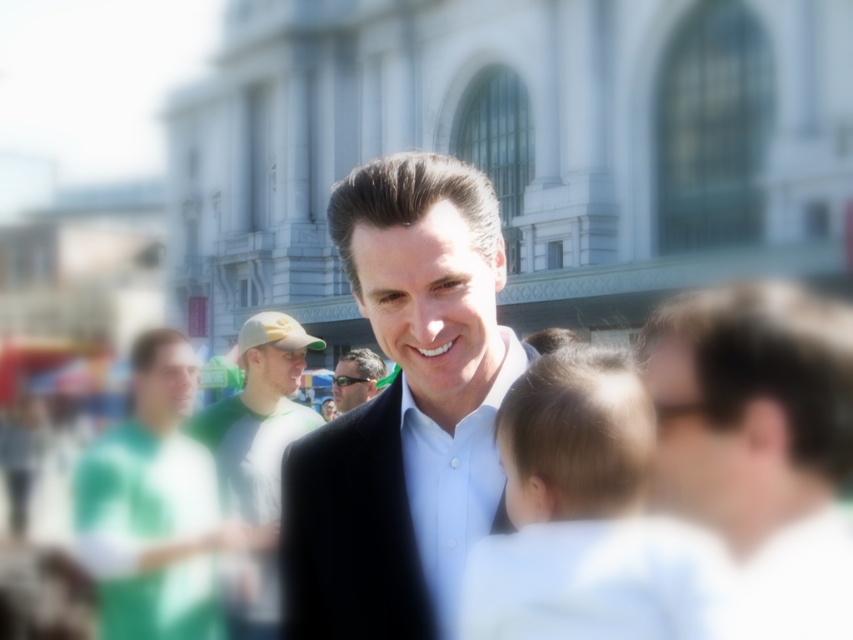
You are a photographer trying to capture a group photo. You have two subjects wearing the green jersey at left and the white smooth shirt at center. Since you want to ensure both are visible, which clothing item should you focus on to avoid blurring due to size differences?

The green jersey at left is larger in size compared to the white smooth shirt at center. To ensure both are visible without blurring, focus on the green jersey at left since its larger size will require more attention to detail.

You are a photographer at an event and need to capture a photo where the green jersey at left and white smooth shirt at center are both visible. Based on their positions, which one should you focus on to ensure the other remains in the background?

The green jersey at left is below the white smooth shirt at center, so focusing on the white smooth shirt at center would keep the green jersey at left in the background.

You are a photographer standing in front of a large white building with classical architecture. You see a man with light brown hair at center in the scene. If you want to take a closer portrait of him without moving your camera, would you need to zoom in or out?

The light brown hair at center is 85.81 feet from viewer, so to take a closer portrait without moving the camera, you would need to zoom in to magnify the subject.